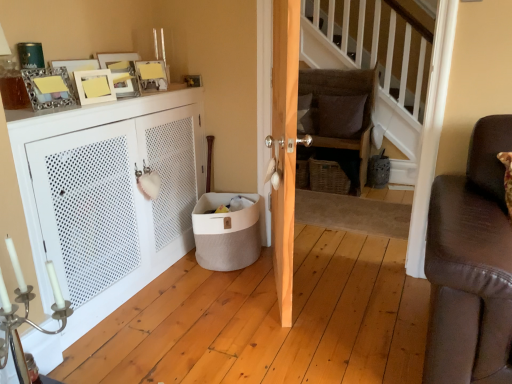
Question: Should I look upward or downward to see white matte cabinet at left?

Choices:
 (A) down
 (B) up

Answer: (A)

Question: Does silver metallic candle holder at lower left turn towards matte yellow picture frame at upper left, which appears as the first picture frame when viewed from the front?

Choices:
 (A) yes
 (B) no

Answer: (B)

Question: Considering the relative sizes of silver metallic candle holder at lower left and matte yellow picture frame at upper left, which appears as the first picture frame when viewed from the front, in the image provided, is silver metallic candle holder at lower left shorter than matte yellow picture frame at upper left, which appears as the first picture frame when viewed from the front,?

Choices:
 (A) no
 (B) yes

Answer: (A)

Question: From a real-world perspective, is silver metallic candle holder at lower left positioned under matte yellow picture frame at upper left, which is the third picture frame in right-to-left order, based on gravity?

Choices:
 (A) no
 (B) yes

Answer: (B)

Question: Considering the relative sizes of silver metallic candle holder at lower left and matte yellow picture frame at upper left, acting as the 2th picture frame starting from the left, in the image provided, is silver metallic candle holder at lower left smaller than matte yellow picture frame at upper left, acting as the 2th picture frame starting from the left,?

Choices:
 (A) no
 (B) yes

Answer: (A)

Question: Does silver metallic candle holder at lower left come in front of matte yellow picture frame at upper left, the 4th picture frame when ordered from back to front?

Choices:
 (A) yes
 (B) no

Answer: (A)

Question: Is silver metallic candle holder at lower left not near matte yellow picture frame at upper left, which appears as the first picture frame when viewed from the front?

Choices:
 (A) yes
 (B) no

Answer: (B)

Question: From a real-world perspective, is silver metallic candle holder at lower left positioned over metallic silver picture frame at upper center, marked as the first picture frame in a back-to-front arrangement, based on gravity?

Choices:
 (A) no
 (B) yes

Answer: (A)

Question: Considering the relative sizes of silver metallic candle holder at lower left and metallic silver picture frame at upper center, arranged as the 4th picture frame when viewed from the left, in the image provided, is silver metallic candle holder at lower left taller than metallic silver picture frame at upper center, arranged as the 4th picture frame when viewed from the left,?

Choices:
 (A) no
 (B) yes

Answer: (B)

Question: Can you confirm if silver metallic candle holder at lower left is positioned to the right of metallic silver picture frame at upper center, marked as the first picture frame in a back-to-front arrangement?

Choices:
 (A) yes
 (B) no

Answer: (B)

Question: Can you confirm if silver metallic candle holder at lower left is shorter than metallic silver picture frame at upper center, arranged as the 4th picture frame when viewed from the left?

Choices:
 (A) no
 (B) yes

Answer: (A)

Question: Would you consider silver metallic candle holder at lower left to be distant from metallic silver picture frame at upper center, arranged as the 4th picture frame when viewed from the left?

Choices:
 (A) yes
 (B) no

Answer: (A)

Question: Is silver metallic candle holder at lower left bigger than metallic silver picture frame at upper center, which is counted as the first picture frame, starting from the right?

Choices:
 (A) no
 (B) yes

Answer: (B)

Question: From the image's perspective, is matte gold picture frame at upper left, placed as the 2th picture frame when sorted from front to back, below woven brown basket at center?

Choices:
 (A) no
 (B) yes

Answer: (A)